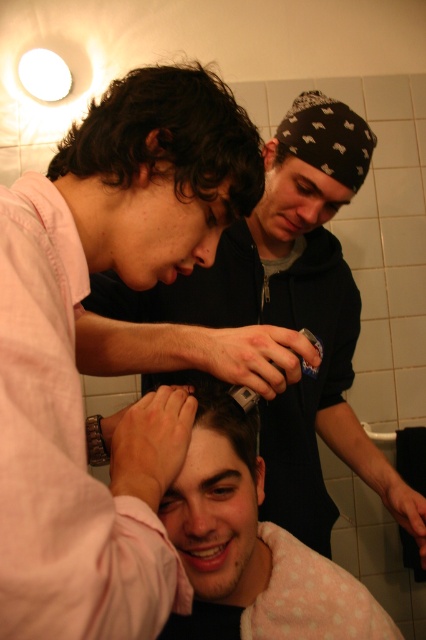
Question: Among these points, which one is nearest to the camera?

Choices:
 (A) (138, 228)
 (B) (195, 340)
 (C) (238, 492)

Answer: (A)

Question: Can you confirm if dark curly hair at center is positioned above smooth skin head at center?

Choices:
 (A) yes
 (B) no

Answer: (A)

Question: Among these points, which one is nearest to the camera?

Choices:
 (A) (244, 579)
 (B) (290, 134)
 (C) (141, 275)

Answer: (C)

Question: Is matte black hair clipper at center further to the viewer compared to dark curly hair at center?

Choices:
 (A) yes
 (B) no

Answer: (A)

Question: Which of the following is the closest to the observer?

Choices:
 (A) (189, 234)
 (B) (199, 440)

Answer: (A)

Question: Does dark curly hair at center appear on the right side of smooth skin head at center?

Choices:
 (A) yes
 (B) no

Answer: (B)